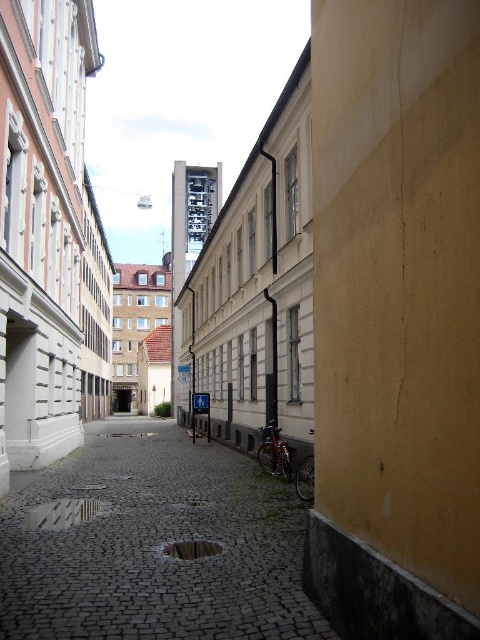
You are navigating through the narrow urban alleyway shown in the image. You see two points marked on the ground. The first point is at coordinate point [25,602], and the second is at point [191,556]. Which point is closer to you as you stand at the entrance of the alleyway?

Point [25,602] is in front of point [191,556], so the first point is closer to you as you stand at the entrance of the alleyway.

You are a delivery drone with a maximum flight altitude of 10 meters. You need to fly from the point at coordinate [66,492] to the taller building with grid structure in the background. Can you safely fly under the altitude limit?

The distance between the point at coordinate [66,492] and the taller building with grid structure in the background is 11.91 meters. Since the drone has a maximum flight altitude of 10 meters, it cannot safely fly under the altitude limit because the required altitude would exceed its maximum capability.

You are a delivery person trying to navigate a narrow alley. You see the cobblestone alley at center and the reflective cobblestone puddle at center. Which one should you avoid stepping on to prevent slipping?

You should avoid stepping on the reflective cobblestone puddle at center because it is a puddle, which is likely wet and slippery, whereas the cobblestone alley at center is dry ground.